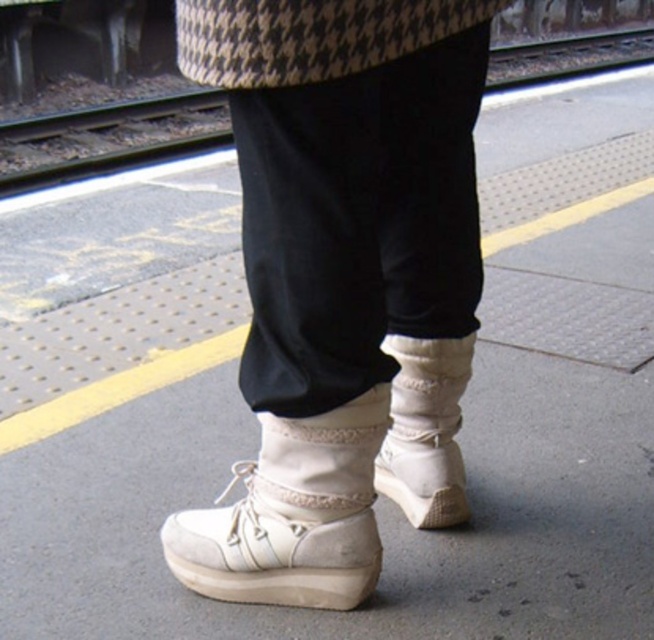
Can you confirm if white suede sneakers at center is positioned to the left of white suede sneaker at center?

Incorrect, white suede sneakers at center is not on the left side of white suede sneaker at center.

Which of these two, white suede sneakers at center or white suede sneaker at center, stands taller?

Standing taller between the two is white suede sneakers at center.

Where is `white suede sneakers at center`? The image size is (654, 640). white suede sneakers at center is located at coordinates click(x=341, y=280).

You are a GUI agent. You are given a task and a screenshot of the screen. Output one action in this format:
    pyautogui.click(x=<x>, y=<y>)
    Task: Click on the white suede sneakers at center
    This screenshot has height=640, width=654.
    Given the screenshot: What is the action you would take?
    pyautogui.click(x=341, y=280)

Consider the image. Is white suede sneaker at center wider than metal train track at upper left?

In fact, white suede sneaker at center might be narrower than metal train track at upper left.

Between white suede sneaker at center and metal train track at upper left, which one appears on the left side from the viewer's perspective?

metal train track at upper left

At what (x,y) coordinates should I click in order to perform the action: click on white suede sneaker at center. Please return your answer as a coordinate pair (x, y). The width and height of the screenshot is (654, 640). Looking at the image, I should click on (290, 515).

The image size is (654, 640). Describe the element at coordinates (290, 515) in the screenshot. I see `white suede sneaker at center` at that location.

Who is more forward, (300, 461) or (415, 380)?

Point (300, 461) is more forward.

Is point (250, 524) farther from viewer compared to point (405, 376)?

No, (250, 524) is closer to viewer.

Image resolution: width=654 pixels, height=640 pixels. I want to click on white suede sneaker at center, so click(290, 515).